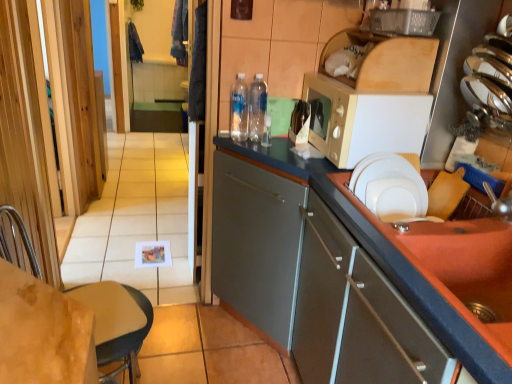
Question: Should I look upward or downward to see matte gray cabinet at right, which is the 1th cabinetry in front-to-back order?

Choices:
 (A) up
 (B) down

Answer: (B)

Question: Does matte gray cabinet at right, marked as the first cabinetry in a back-to-front arrangement, have a greater height compared to dark blue fabric at upper left, the 2th laundry from the right?

Choices:
 (A) no
 (B) yes

Answer: (B)

Question: Is matte gray cabinet at right, which is counted as the second cabinetry, starting from the front, shorter than dark blue fabric at upper left, arranged as the 1th laundry when viewed from the back?

Choices:
 (A) no
 (B) yes

Answer: (A)

Question: Is matte gray cabinet at right, marked as the first cabinetry in a back-to-front arrangement, bigger than dark blue fabric at upper left, the 2th laundry from the right?

Choices:
 (A) yes
 (B) no

Answer: (A)

Question: Can you confirm if matte gray cabinet at right, which is counted as the second cabinetry, starting from the front, is wider than dark blue fabric at upper left, the first laundry viewed from the left?

Choices:
 (A) yes
 (B) no

Answer: (A)

Question: From a real-world perspective, is matte gray cabinet at right, which is counted as the second cabinetry, starting from the front, positioned over dark blue fabric at upper left, the 2th laundry from the right, based on gravity?

Choices:
 (A) no
 (B) yes

Answer: (A)

Question: Is dark blue fabric at upper left, the second laundry when ordered from front to back, at the back of matte gray cabinet at right, which is counted as the second cabinetry, starting from the front?

Choices:
 (A) no
 (B) yes

Answer: (A)

Question: Is dark blue fabric at upper left, the second laundry when ordered from front to back, smaller than light brown leather chair at lower left?

Choices:
 (A) yes
 (B) no

Answer: (A)

Question: Considering the relative positions of dark blue fabric at upper left, the first laundry viewed from the left, and light brown leather chair at lower left in the image provided, is dark blue fabric at upper left, the first laundry viewed from the left, to the right of light brown leather chair at lower left from the viewer's perspective?

Choices:
 (A) yes
 (B) no

Answer: (B)

Question: Is dark blue fabric at upper left, the 2th laundry from the right, far away from light brown leather chair at lower left?

Choices:
 (A) no
 (B) yes

Answer: (B)

Question: Is dark blue fabric at upper left, arranged as the 1th laundry when viewed from the back, touching light brown leather chair at lower left?

Choices:
 (A) yes
 (B) no

Answer: (B)

Question: From a real-world perspective, is dark blue fabric at upper left, the 2th laundry from the right, located beneath light brown leather chair at lower left?

Choices:
 (A) yes
 (B) no

Answer: (B)

Question: Is dark blue fabric at upper left, arranged as the 1th laundry when viewed from the back, surrounding light brown leather chair at lower left?

Choices:
 (A) no
 (B) yes

Answer: (A)

Question: From the image's perspective, is clear plastic bottles at center, which appears as the second bottle when viewed from the right, beneath blue fabric laundry at upper left, the 2th laundry positioned from the left?

Choices:
 (A) no
 (B) yes

Answer: (B)